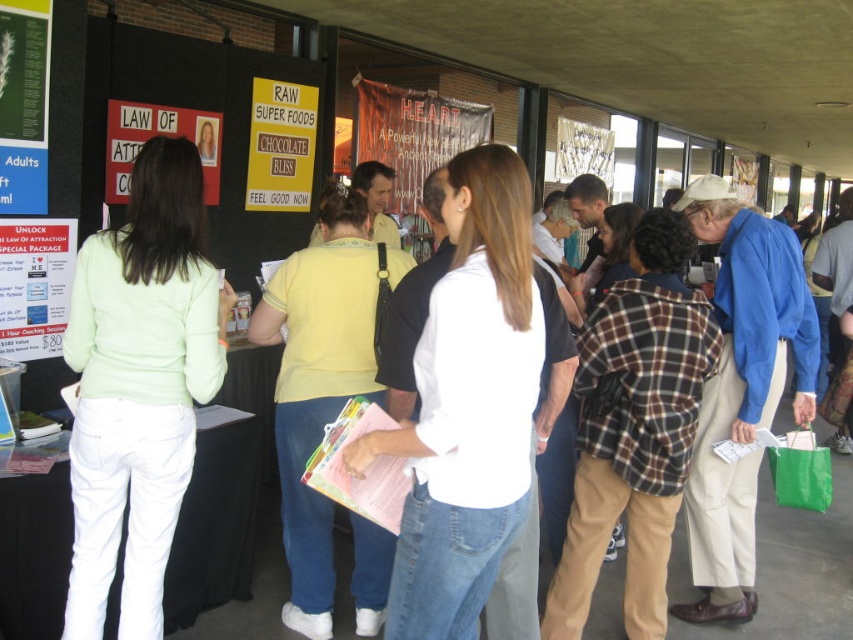
Looking at this image, you are organizing a health fair and need to arrange two shirts on a display rack. The white cotton shirt at center and the blue cotton shirt at center must be placed side by side. Which shirt should you place on the narrower side of the rack to ensure they both fit properly?

The white cotton shirt at center is thinner than the blue cotton shirt at center, so place the white cotton shirt at center on the narrower side of the rack to ensure both shirts fit properly.

You are a photographer at the wellness fair and want to capture a photo of both the white cotton shirt at center and the blue cotton shirt at center. Which shirt should you focus on first if you want to include both in the same frame without moving the camera?

The white cotton shirt at center is above the blue cotton shirt at center, so you should focus on the white cotton shirt at center first to ensure both are in the frame.

You are attending a health fair and need to locate the person wearing the white cotton shirt at center. According to the scene description, where would you find this individual in relation to the large windows along the back wall?

The white cotton shirt at center is located at point [467,404], which is closer to the back wall with the large windows since the coordinates place it near the center of the image. However, since the scene description mentions the large windows are along the back wall, the person is likely positioned towards the middle area between the front and the back windows.